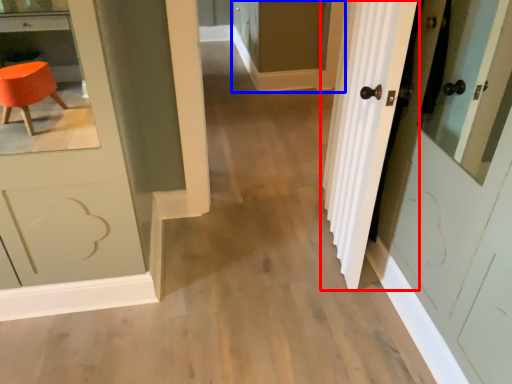
Question: Which point is further to the camera, door (highlighted by a red box) or screen door (highlighted by a blue box)?

Choices:
 (A) door
 (B) screen door

Answer: (B)